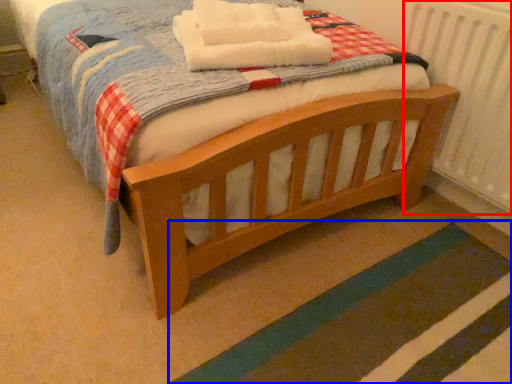
Question: Which object appears farthest to the camera in this image, radiator (highlighted by a red box) or strip (highlighted by a blue box)?

Choices:
 (A) radiator
 (B) strip

Answer: (A)